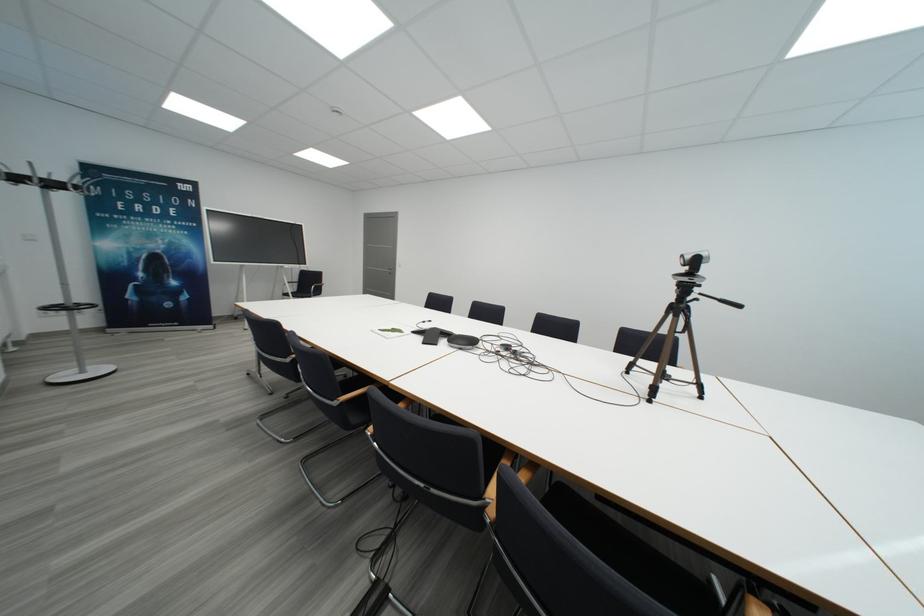
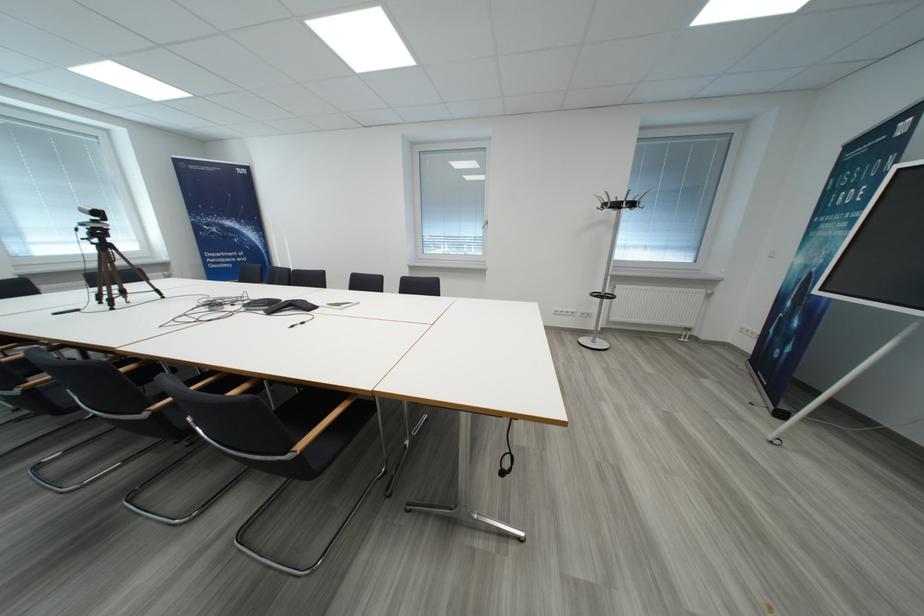
Find the pixel in the second image that matches pixel 119 248 in the first image.

(807, 264)